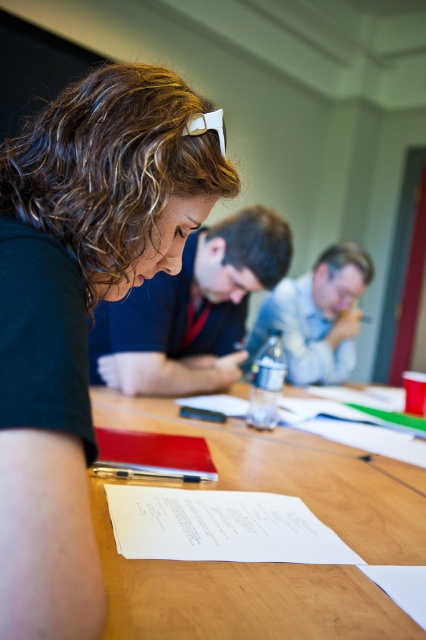
From the picture: You are standing in the room where the group is seated. If you want to place a small plant on the wooden table at center, where should you place it so that it is exactly at the point labeled as point (x=239, y=596)?

The point labeled as point (x=239, y=596) corresponds to the wooden table at center, so you should place the small plant exactly at that location on the wooden table at center.

You are a student who needs to pass a notebook to your classmate sitting across the table. The notebook is placed on the red leather notepad at lower center. Your classmate is seated near the matte black notepad at center. If you can reach 45 centimeters, can you pass the notebook without getting up?

The distance between the red leather notepad at lower center and the matte black notepad at center is 43.96 centimeters. Since your reach is 45 centimeters, you can pass the notebook without getting up.

You are a person who is 1.7 meters tall. You are sitting at the wooden table at center and wearing the matte black shirt at center. Do you think your head will touch the ceiling if you stand up straight?

The wooden table at center has a lesser height compared to matte black shirt at center. Since the table is shorter than the shirt, the height of the table does not directly indicate the ceiling height. However, if the matte black shirt at center is part of a person who is 1.7 meters tall, standing up might cause their head to touch the ceiling depending on the room dimensions not specified here. The given information does not provide ceiling height, so we cannot confirm.